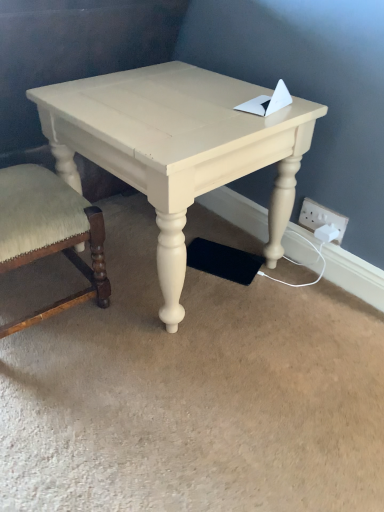
Locate an element on the screen. The image size is (384, 512). free space in front of matte cream table at center is located at coordinates (176, 392).